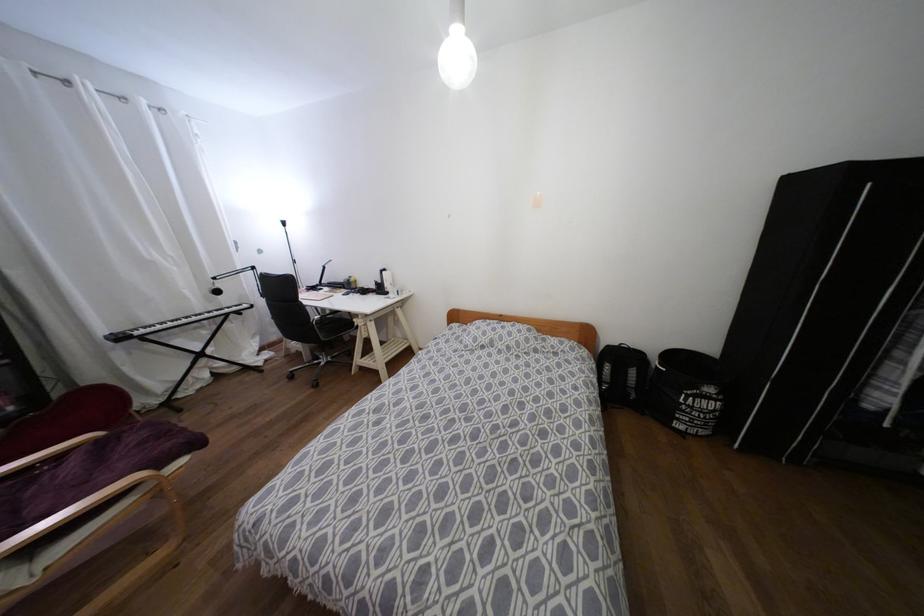
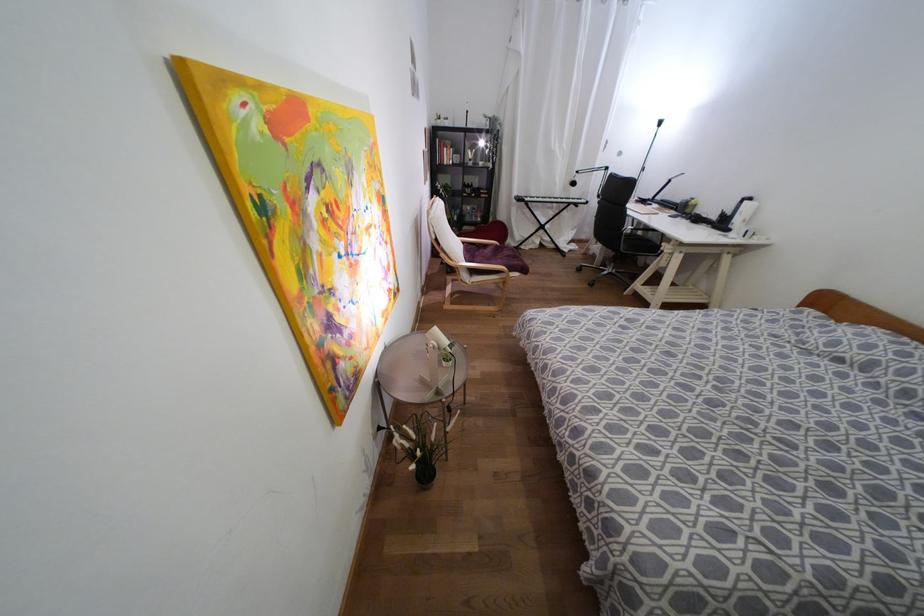
In the second image, find the point that corresponds to pixel 383 270 in the first image.

(749, 198)